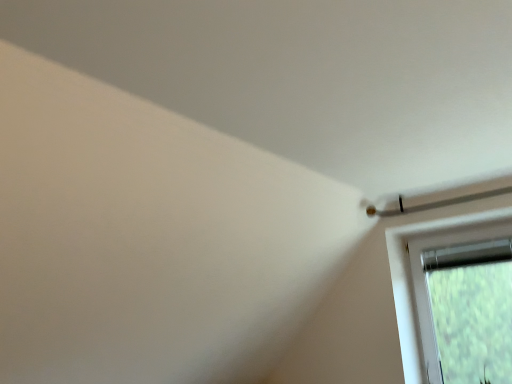
Find the location of a particular element. transparent plastic window at upper right is located at coordinates (406, 273).

Measure the distance between transparent plastic window at upper right and camera.

7.61 feet.

Describe the element at coordinates (406, 273) in the screenshot. I see `transparent plastic window at upper right` at that location.

You are a GUI agent. You are given a task and a screenshot of the screen. Output one action in this format:
    pyautogui.click(x=<x>, y=<y>)
    Task: Click on the transparent plastic window at upper right
    The height and width of the screenshot is (384, 512).
    Given the screenshot: What is the action you would take?
    pyautogui.click(x=406, y=273)